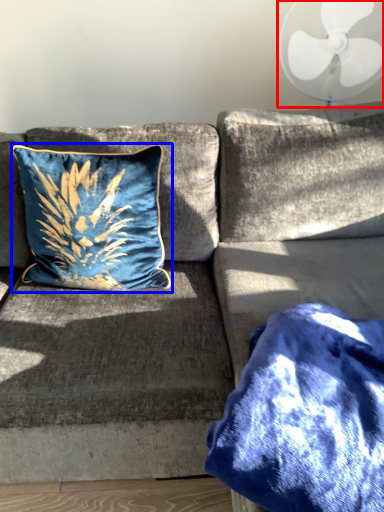
Question: Which object appears farthest to the camera in this image, mechanical fan (highlighted by a red box) or pillow (highlighted by a blue box)?

Choices:
 (A) mechanical fan
 (B) pillow

Answer: (A)